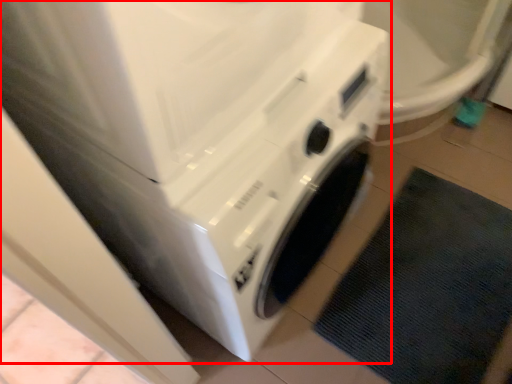
Question: From the image's perspective, what is the correct spatial relationship of washing machine (annotated by the red box) in relation to bath mat?

Choices:
 (A) above
 (B) below

Answer: (A)